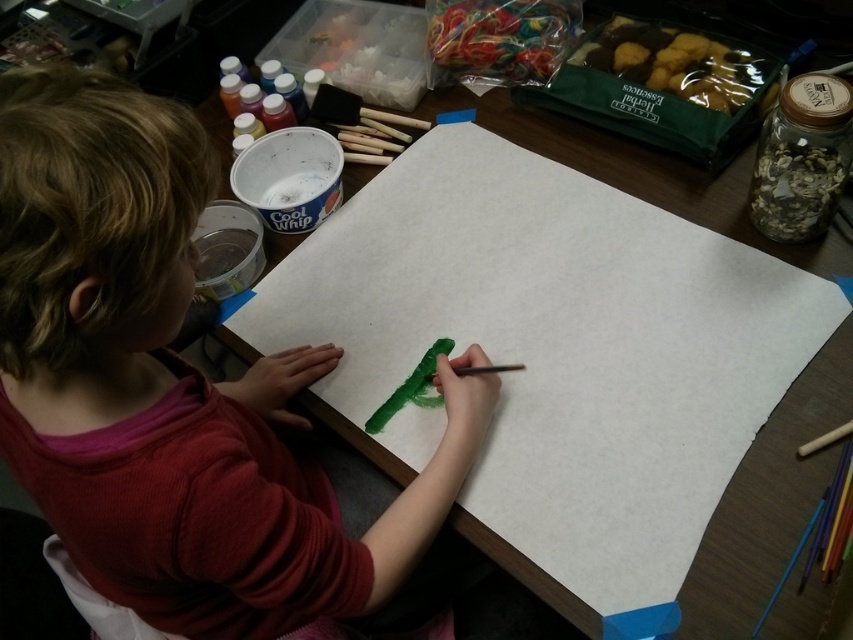
You are an art teacher observing a child at a table. You need to ensure the child is using the correct materials. Which object is bigger in size between the smooth red shirt at center and the green matte paint brush at center?

The smooth red shirt at center is larger in size than the green matte paint brush at center.

You are an art teacher observing a child at a table. The child is wearing a smooth red shirt at center and using a green matte paint brush at center. Based on the scene, which object is wider?

The smooth red shirt at center might be wider than green matte paint brush at center, so the smooth red shirt at center is likely wider.

You are a photographer trying to capture a closeup of the multicolored plastic paintbrush at lower right without including the smooth red shirt at center in the frame. Is this possible given their sizes?

The smooth red shirt at center is much taller than the multicolored plastic paintbrush at lower right, so it may be challenging to frame the paintbrush without including the shirt in the shot.